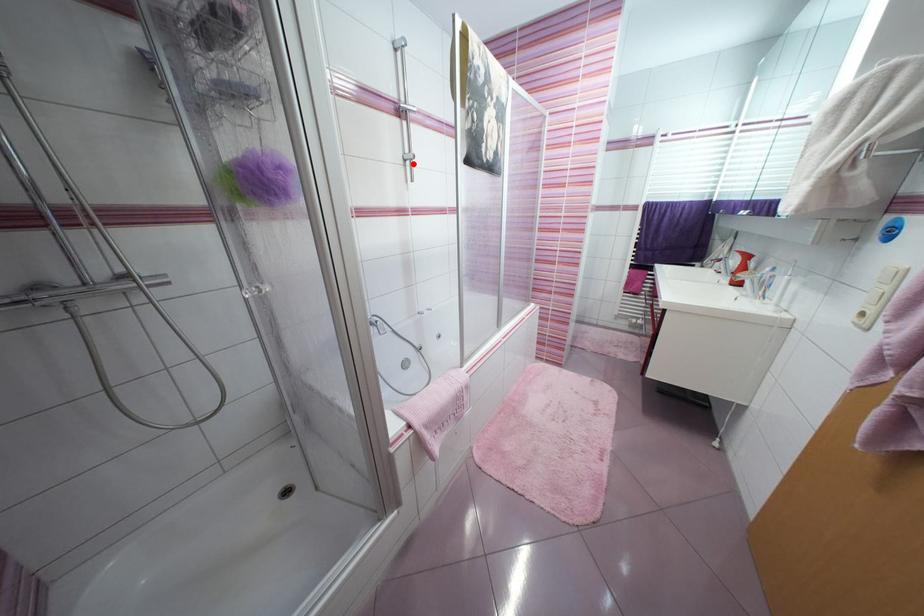
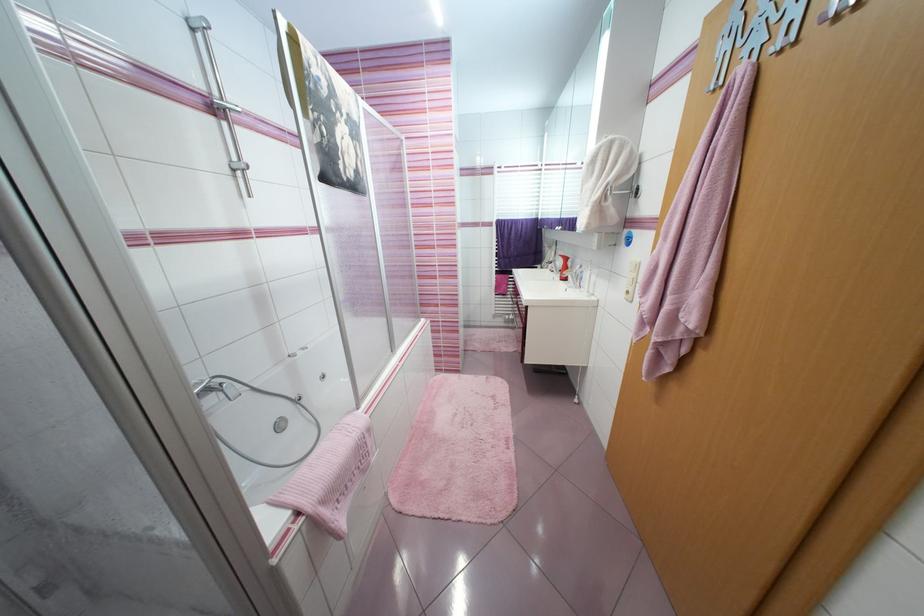
Question: I am providing you with two images of the same scene from different viewpoints. Image1 has a red point marked. In image2, the corresponding 3D location appears at what relative position? Reply with the corresponding letter.

Choices:
 (A) Closer
 (B) Farther

Answer: (B)